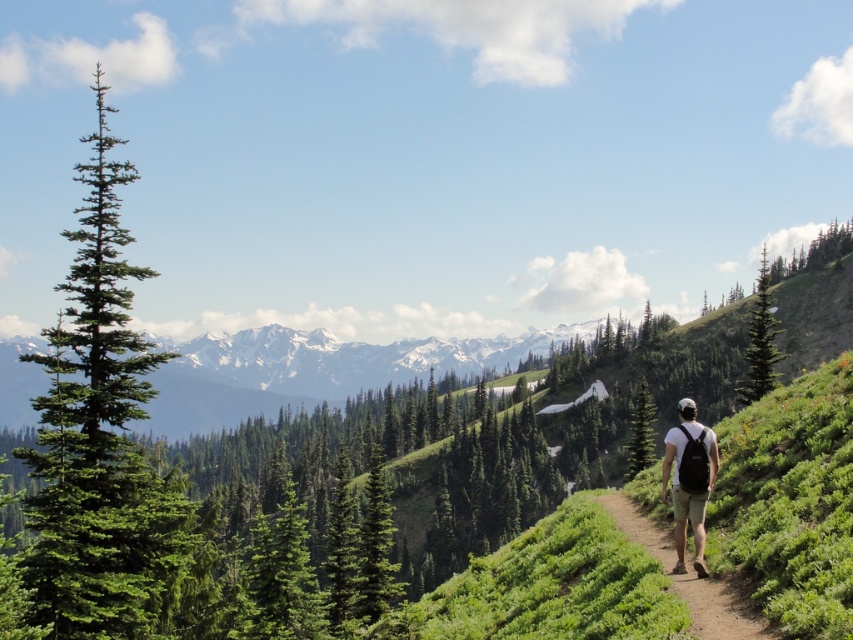
Which is more to the right, brown dirt path at center or white cotton shirt at center?

white cotton shirt at center

Which of these two, brown dirt path at center or white cotton shirt at center, stands taller?

white cotton shirt at center

The image size is (853, 640). I want to click on brown dirt path at center, so click(x=718, y=609).

Does white cotton shirt at center come behind green needle-like tree at center?

No, it is not.

Who is higher up, white cotton shirt at center or green needle-like tree at center?

white cotton shirt at center is higher up.

Is point (682, 570) positioned in front of point (379, 502)?

Yes, it is in front of point (379, 502).

The image size is (853, 640). Identify the location of white cotton shirt at center. (689, 481).

Can you confirm if white cotton shirt at center is smaller than green textured tree at upper right?

Yes.

Does point (717, 467) come in front of point (769, 380)?

Yes, it is in front of point (769, 380).

Find the location of a particular element. white cotton shirt at center is located at coordinates (689, 481).